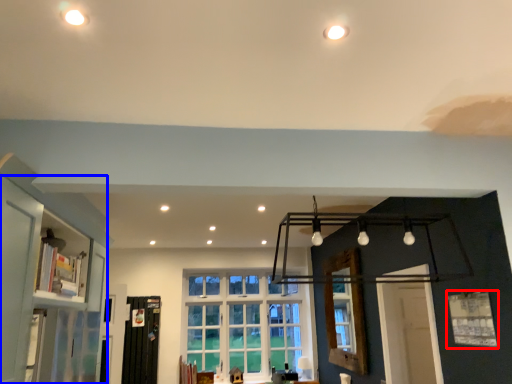
Question: Which object is closer to the camera taking this photo, window (highlighted by a red box) or bookshelf (highlighted by a blue box)?

Choices:
 (A) window
 (B) bookshelf

Answer: (B)